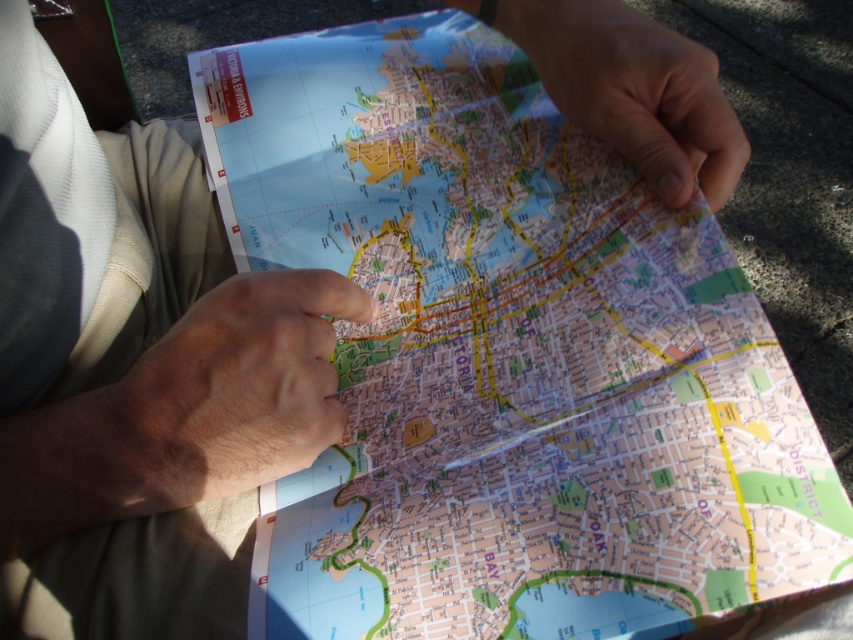
Question: Which point is closer to the camera?

Choices:
 (A) (573, 36)
 (B) (346, 307)

Answer: (B)

Question: Is smooth skin hand at center thinner than matte paper hand at upper right?

Choices:
 (A) no
 (B) yes

Answer: (B)

Question: Is smooth skin hand at center to the right of matte paper hand at upper right from the viewer's perspective?

Choices:
 (A) no
 (B) yes

Answer: (A)

Question: Does smooth skin hand at center appear on the right side of matte paper hand at upper right?

Choices:
 (A) no
 (B) yes

Answer: (A)

Question: Which point is farther from the camera taking this photo?

Choices:
 (A) (560, 65)
 (B) (303, 300)

Answer: (A)